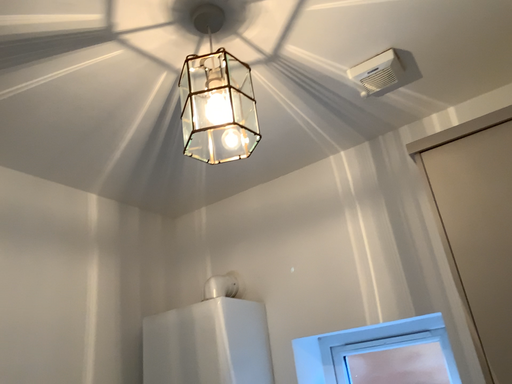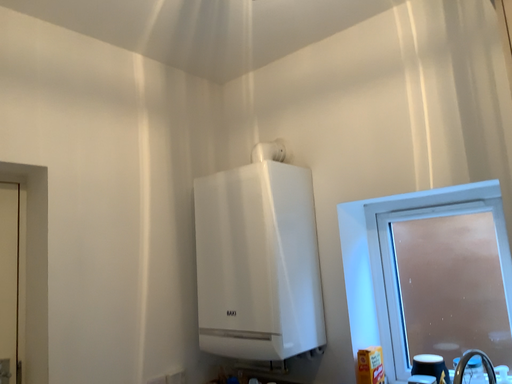
Question: Which way did the camera rotate in the video?

Choices:
 (A) rotated upward
 (B) rotated downward

Answer: (B)